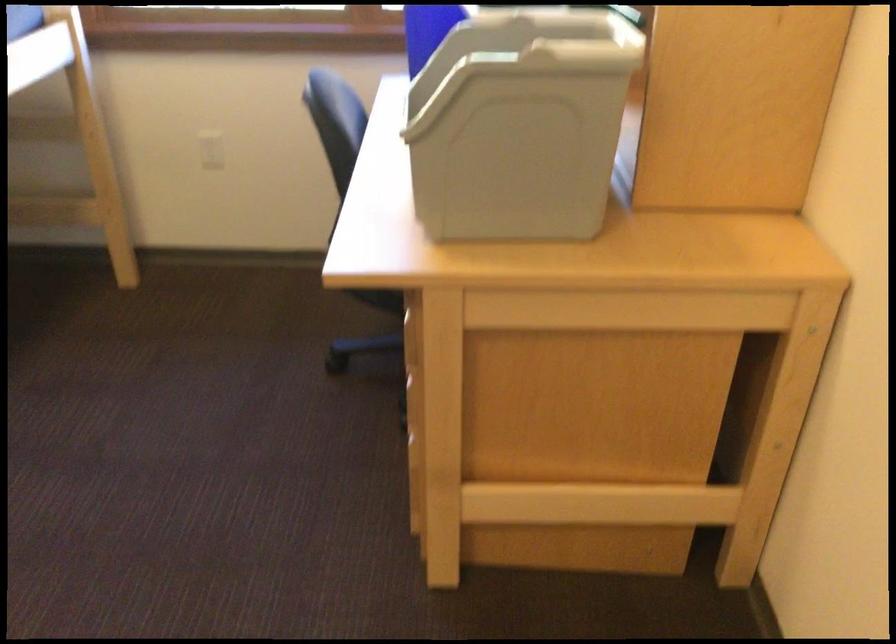
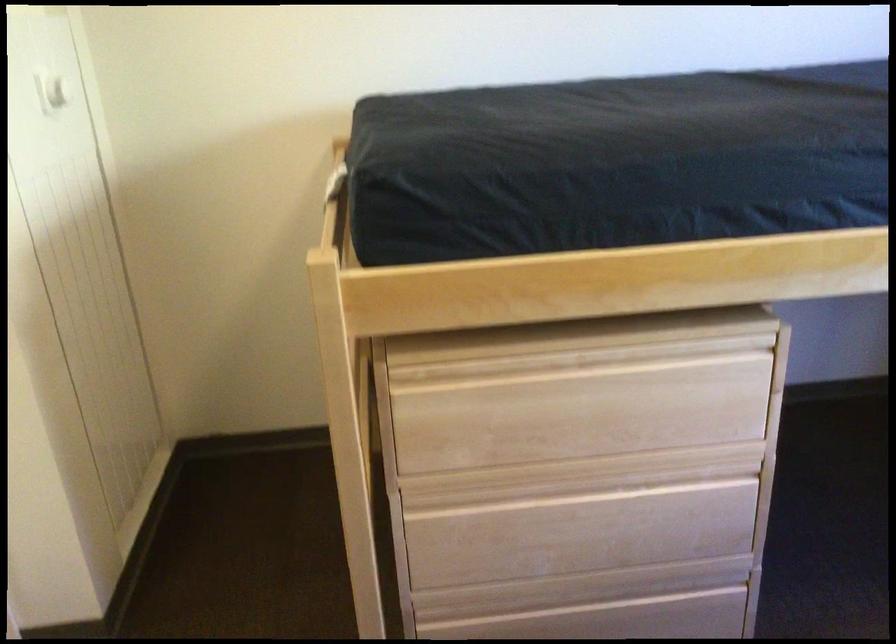
Based on the continuous images, in which direction is the camera rotating?

The rotation direction of the camera is left-down.